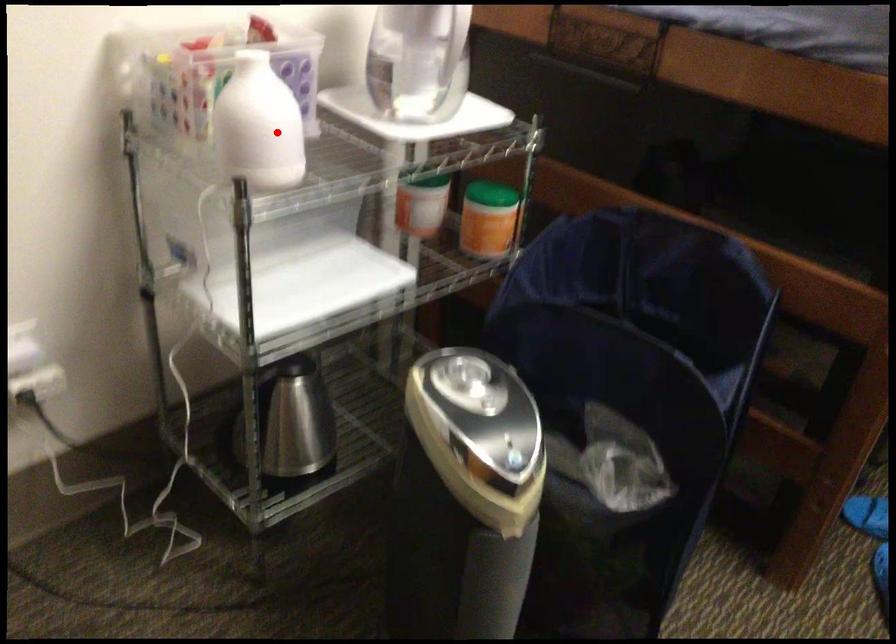
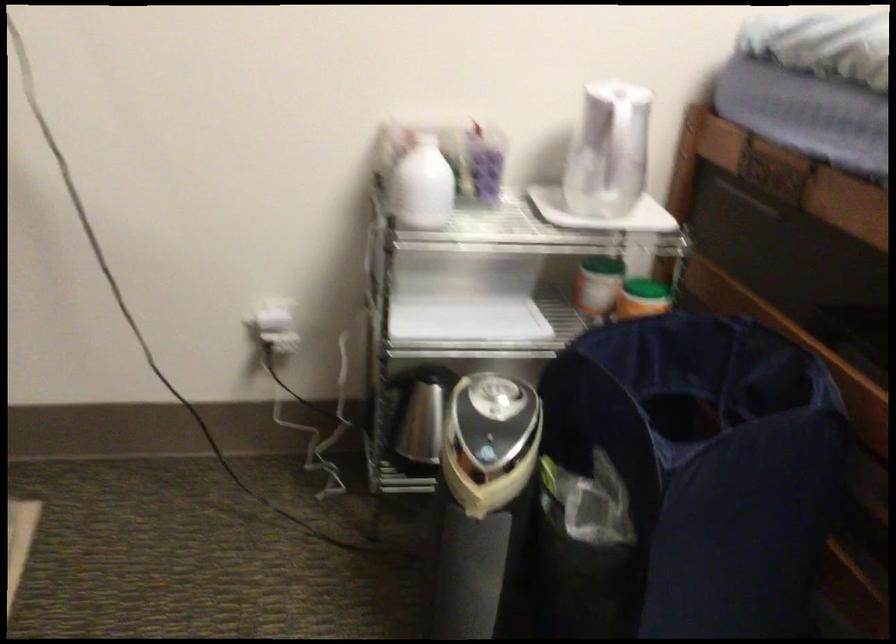
Question: I am providing you with two images of the same scene from different viewpoints. A red point is shown in image1. For the corresponding object point in image2, is it positioned nearer or farther from the camera?

Choices:
 (A) Nearer
 (B) Farther

Answer: (B)